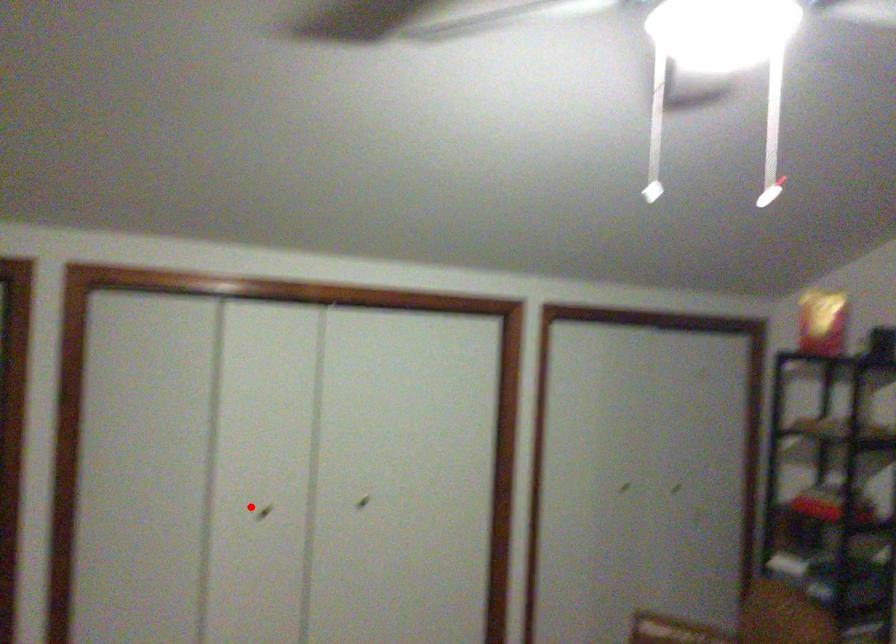
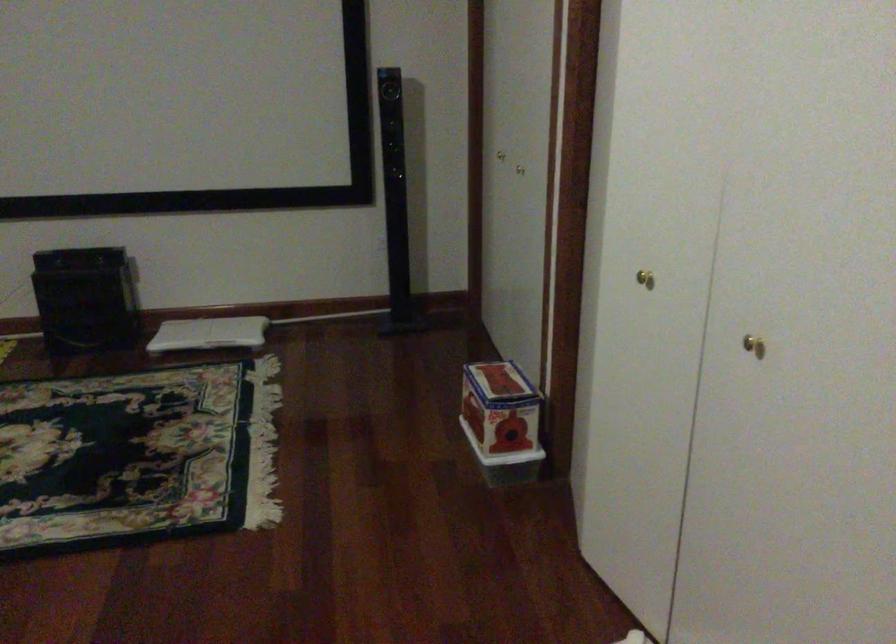
Where in the second image is the point corresponding to the highlighted location from the first image?

(644, 279)